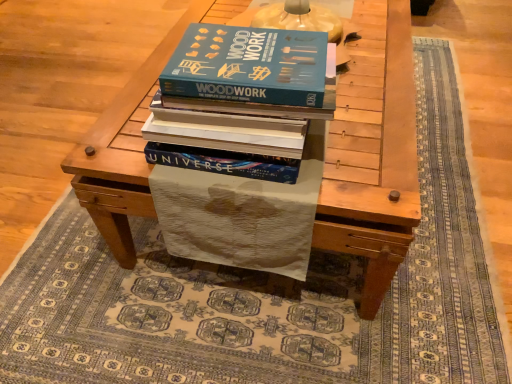
Question: Is blue hardcover book at center positioned in front of wooden table at center?

Choices:
 (A) no
 (B) yes

Answer: (B)

Question: Is blue hardcover book at center facing away from wooden table at center?

Choices:
 (A) yes
 (B) no

Answer: (B)

Question: Can you confirm if blue hardcover book at center is thinner than wooden table at center?

Choices:
 (A) yes
 (B) no

Answer: (A)

Question: From the image's perspective, is blue hardcover book at center above wooden table at center?

Choices:
 (A) yes
 (B) no

Answer: (B)

Question: Would you say blue hardcover book at center contains wooden table at center?

Choices:
 (A) no
 (B) yes

Answer: (A)

Question: Is blue hardcover book at center wider than wooden table at center?

Choices:
 (A) no
 (B) yes

Answer: (A)

Question: Is wooden table at center shorter than blue hardcover book at center?

Choices:
 (A) yes
 (B) no

Answer: (B)

Question: Is wooden table at center placed right next to blue hardcover book at center?

Choices:
 (A) yes
 (B) no

Answer: (B)

Question: From the image's perspective, is wooden table at center located above blue hardcover book at center?

Choices:
 (A) yes
 (B) no

Answer: (A)

Question: Could blue hardcover book at center be considered to be inside wooden table at center?

Choices:
 (A) yes
 (B) no

Answer: (B)

Question: Is wooden table at center bigger than blue hardcover book at center?

Choices:
 (A) yes
 (B) no

Answer: (A)

Question: Does wooden table at center come in front of blue hardcover book at center?

Choices:
 (A) yes
 (B) no

Answer: (B)

Question: Is wooden table at center inside the boundaries of blue hardcover book at center, or outside?

Choices:
 (A) outside
 (B) inside

Answer: (A)